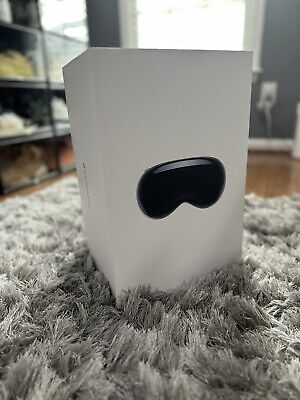
This screenshot has width=300, height=400. In order to click on shag rug in this screenshot , I will do `click(36, 241)`, `click(104, 366)`, `click(58, 329)`, `click(197, 338)`, `click(283, 226)`.